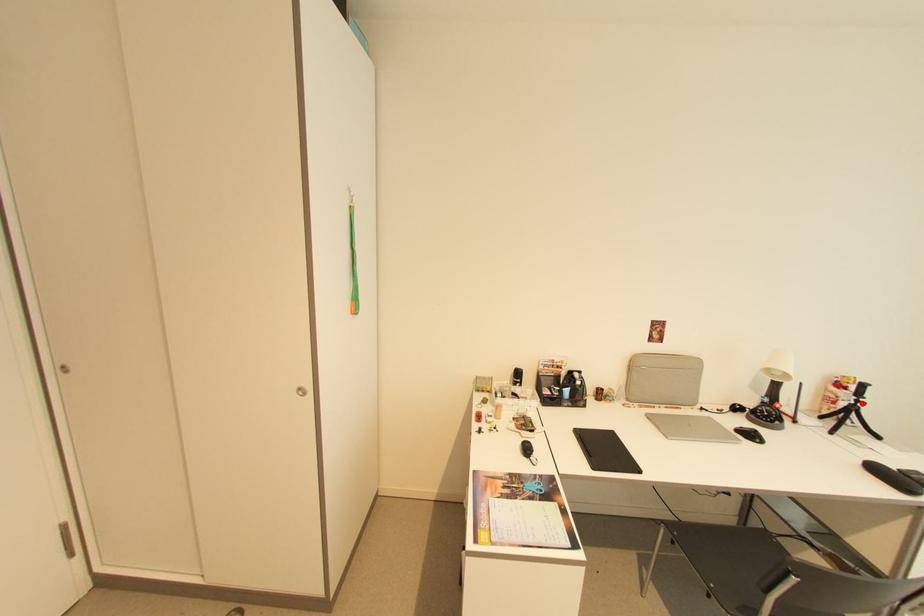
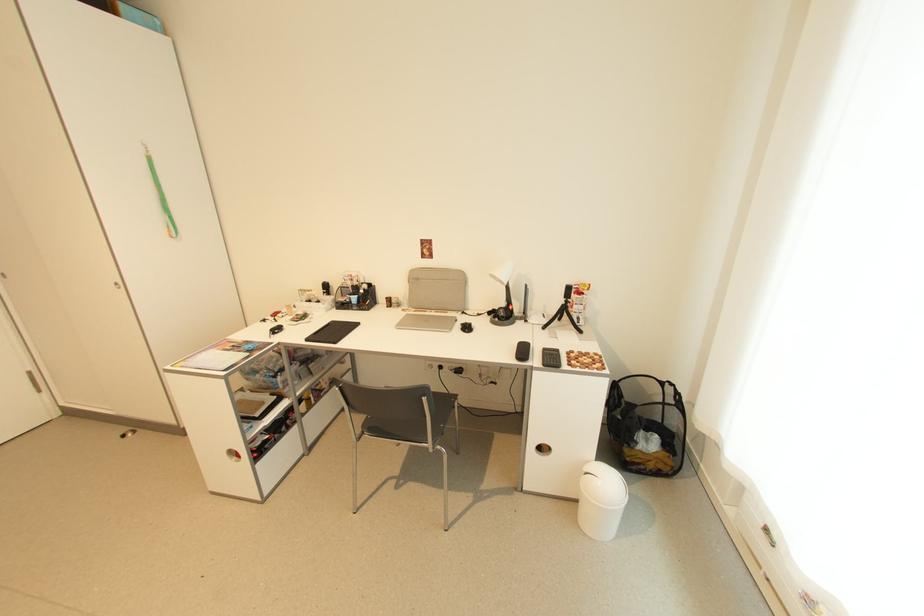
The point at the highlighted location is marked in the first image. Where is the corresponding point in the second image?

(572, 302)